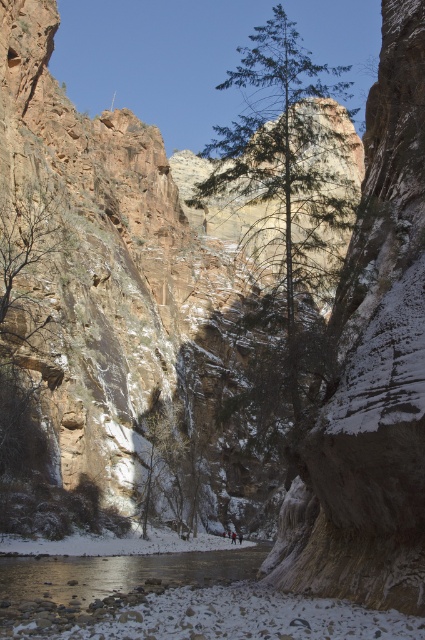
Question: Which object is the closest to the red jacket at center?

Choices:
 (A) clear water at lower center
 (B) green textured tree at center

Answer: (A)

Question: Does green textured tree at center appear over clear water at lower center?

Choices:
 (A) no
 (B) yes

Answer: (B)

Question: Which object is farther from the camera taking this photo?

Choices:
 (A) red jacket at center
 (B) clear water at lower center
 (C) green textured tree at center

Answer: (A)

Question: Does clear water at lower center appear over red jacket at center?

Choices:
 (A) yes
 (B) no

Answer: (A)

Question: Is green textured tree at center smaller than clear water at lower center?

Choices:
 (A) yes
 (B) no

Answer: (B)

Question: Which object is farther from the camera taking this photo?

Choices:
 (A) clear water at lower center
 (B) green textured tree at center
 (C) red jacket at center

Answer: (C)